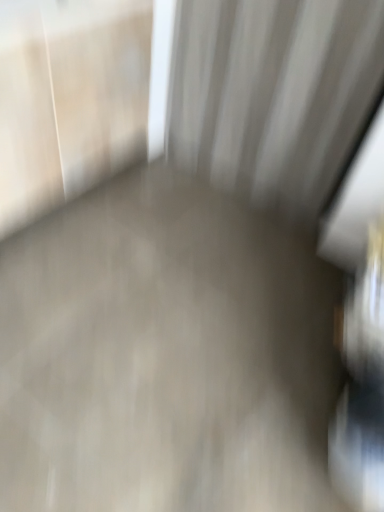
Question: Does smooth concrete floor at center have a lesser height compared to white textured curtain at upper center?

Choices:
 (A) no
 (B) yes

Answer: (B)

Question: Does smooth concrete floor at center have a smaller size compared to white textured curtain at upper center?

Choices:
 (A) yes
 (B) no

Answer: (B)

Question: Can you confirm if smooth concrete floor at center is positioned to the left of white textured curtain at upper center?

Choices:
 (A) yes
 (B) no

Answer: (A)

Question: From the image's perspective, does smooth concrete floor at center appear lower than white textured curtain at upper center?

Choices:
 (A) no
 (B) yes

Answer: (B)

Question: Considering the relative sizes of smooth concrete floor at center and white textured curtain at upper center in the image provided, is smooth concrete floor at center thinner than white textured curtain at upper center?

Choices:
 (A) no
 (B) yes

Answer: (A)

Question: Is white textured curtain at upper center a part of smooth concrete floor at center?

Choices:
 (A) no
 (B) yes

Answer: (A)

Question: Is white textured curtain at upper center next to smooth concrete floor at center and touching it?

Choices:
 (A) no
 (B) yes

Answer: (A)

Question: Considering the relative positions of white textured curtain at upper center and smooth concrete floor at center in the image provided, is white textured curtain at upper center in front of smooth concrete floor at center?

Choices:
 (A) yes
 (B) no

Answer: (B)

Question: Is white textured curtain at upper center shorter than smooth concrete floor at center?

Choices:
 (A) yes
 (B) no

Answer: (B)

Question: Is smooth concrete floor at center surrounded by white textured curtain at upper center?

Choices:
 (A) no
 (B) yes

Answer: (A)

Question: Can we say white textured curtain at upper center lies outside smooth concrete floor at center?

Choices:
 (A) no
 (B) yes

Answer: (B)

Question: Is white textured curtain at upper center facing away from smooth concrete floor at center?

Choices:
 (A) yes
 (B) no

Answer: (B)

Question: Is point (311, 251) closer or farther from the camera than point (379, 72)?

Choices:
 (A) closer
 (B) farther

Answer: (B)